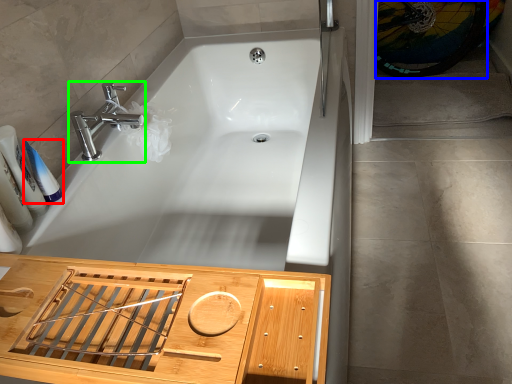
Question: Which object is positioned farthest from toiletry (highlighted by a red box)? Select from bicycle wheel (highlighted by a blue box) and tap (highlighted by a green box).

Choices:
 (A) bicycle wheel
 (B) tap

Answer: (A)